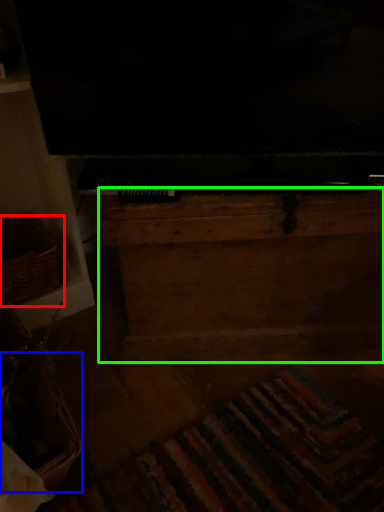
Question: Based on their relative distances, which object is farther from basket (highlighted by a red box)? Choose from basket (highlighted by a blue box) and dresser (highlighted by a green box).

Choices:
 (A) basket
 (B) dresser

Answer: (B)